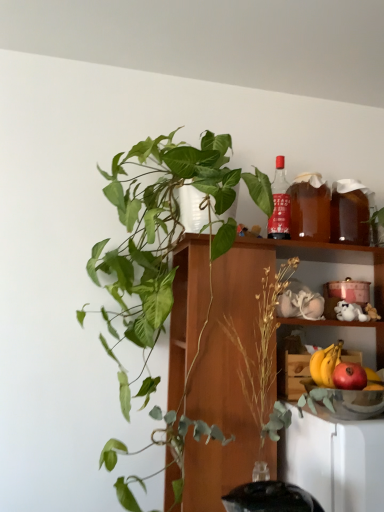
Measure the distance between point [171,250] and camera.

1.64 meters.

You are a GUI agent. You are given a task and a screenshot of the screen. Output one action in this format:
    pyautogui.click(x=<x>, y=<y>)
    Task: Click on the red glass bottle at upper right
    Image resolution: width=384 pixels, height=512 pixels.
    Given the screenshot: What is the action you would take?
    pyautogui.click(x=280, y=204)

How much space does brown translucent beverage at upper right, the 2th beverage positioned from the right, occupy vertically?

brown translucent beverage at upper right, the 2th beverage positioned from the right, is 10.94 inches tall.

Based on the photo, what is the approximate height of wooden shelf at upper center?

wooden shelf at upper center is 29.13 inches tall.

Where is `green matte plant at upper left`? Image resolution: width=384 pixels, height=512 pixels. green matte plant at upper left is located at coordinates (163, 265).

From a real-world perspective, is transparent glass bowl at lower right positioned above or below wooden shelf at upper center?

transparent glass bowl at lower right is situated lower than wooden shelf at upper center in the real world.

Is transparent glass bowl at lower right at the right side of wooden shelf at upper center?

Correct, you'll find transparent glass bowl at lower right to the right of wooden shelf at upper center.

Image resolution: width=384 pixels, height=512 pixels. Find the location of `glass bowl that appears below the wooden shelf at upper center (from a real-world perspective)`. glass bowl that appears below the wooden shelf at upper center (from a real-world perspective) is located at coordinates click(357, 403).

In the scene shown: From a real-world perspective, between transparent glass bowl at lower right and yellow matte banana at lower right, who is vertically lower?

transparent glass bowl at lower right is physically lower.

Is transparent glass bowl at lower right far from yellow matte banana at lower right?

No, transparent glass bowl at lower right is not far away from yellow matte banana at lower right.

Consider the image. Can you confirm if transparent glass bowl at lower right is taller than yellow matte banana at lower right?

No, transparent glass bowl at lower right is not taller than yellow matte banana at lower right.

Is transparent glass bowl at lower right inside the boundaries of yellow matte banana at lower right, or outside?

transparent glass bowl at lower right exists outside the volume of yellow matte banana at lower right.

Is point (281, 238) behind point (316, 356)?

That is True.

Find the location of `bottle above the yellow matte banana at lower right (from a real-world perspective)`. bottle above the yellow matte banana at lower right (from a real-world perspective) is located at coordinates (280, 204).

From the image's perspective, is red glass bottle at upper right over yellow matte banana at lower right?

Yes, from the image's perspective, red glass bottle at upper right is on top of yellow matte banana at lower right.

Based on the photo, from a real-world perspective, is red glass bottle at upper right on yellow matte banana at lower right?

Yes, from a real-world perspective, red glass bottle at upper right is above yellow matte banana at lower right.

In the scene shown: From the image's perspective, between brown translucent beverage at upper right, the 2th beverage positioned from the right, and wooden shelf at upper center, who is located below?

wooden shelf at upper center.

Considering the relative sizes of brown translucent beverage at upper right, the 2th beverage positioned from the right, and wooden shelf at upper center in the image provided, is brown translucent beverage at upper right, the 2th beverage positioned from the right, shorter than wooden shelf at upper center?

Correct, brown translucent beverage at upper right, the 2th beverage positioned from the right, is not as tall as wooden shelf at upper center.

Considering the relative positions of brown translucent beverage at upper right, the 2th beverage positioned from the right, and wooden shelf at upper center in the image provided, is brown translucent beverage at upper right, the 2th beverage positioned from the right, to the right of wooden shelf at upper center from the viewer's perspective?

Indeed, brown translucent beverage at upper right, the 2th beverage positioned from the right, is positioned on the right side of wooden shelf at upper center.

Can you confirm if brown translucent beverage at upper right, the first beverage from the left, is thinner than wooden shelf at upper center?

Correct, the width of brown translucent beverage at upper right, the first beverage from the left, is less than that of wooden shelf at upper center.

Between red matte apple at lower right and yellow matte banana at lower right, which one appears on the right side from the viewer's perspective?

red matte apple at lower right.

Is point (354, 379) closer to viewer compared to point (325, 370)?

Yes, it is in front of point (325, 370).

Considering the relative sizes of red matte apple at lower right and yellow matte banana at lower right in the image provided, is red matte apple at lower right taller than yellow matte banana at lower right?

Incorrect, the height of red matte apple at lower right is not larger of that of yellow matte banana at lower right.

From a real-world perspective, is red matte apple at lower right under yellow matte banana at lower right?

Correct, in the physical world, red matte apple at lower right is lower than yellow matte banana at lower right.

Between yellow matte banana at lower right and red matte apple at lower right, which one has smaller width?

Thinner between the two is yellow matte banana at lower right.

From the image's perspective, is yellow matte banana at lower right above or below red matte apple at lower right?

yellow matte banana at lower right is situated higher than red matte apple at lower right in the image.

Is yellow matte banana at lower right shorter than red matte apple at lower right?

No.

Is red matte apple at lower right at the back of yellow matte banana at lower right?

Yes, red matte apple at lower right is at the back of yellow matte banana at lower right.

Considering the sizes of objects translucent amber liquid at shelf right, arranged as the 1th beverage when viewed from the right, and red matte apple at lower right in the image provided, who is wider, translucent amber liquid at shelf right, arranged as the 1th beverage when viewed from the right, or red matte apple at lower right?

translucent amber liquid at shelf right, arranged as the 1th beverage when viewed from the right.

Does point (333, 234) appear closer or farther from the camera than point (349, 373)?

Point (333, 234).

Which is more to the left, translucent amber liquid at shelf right, arranged as the 1th beverage when viewed from the right, or red matte apple at lower right?

From the viewer's perspective, red matte apple at lower right appears more on the left side.

You are a GUI agent. You are given a task and a screenshot of the screen. Output one action in this format:
    pyautogui.click(x=<x>, y=<y>)
    Task: Click on the apple below the translucent amber liquid at shelf right, arranged as the 2th beverage when viewed from the left (from the image's perspective)
    The width and height of the screenshot is (384, 512).
    Given the screenshot: What is the action you would take?
    pyautogui.click(x=349, y=376)

Find the location of a particular element. The image size is (384, 512). shelf that appears above the transparent glass bowl at lower right (from a real-world perspective) is located at coordinates (241, 361).

Where is `glass bowl that is on the right side of yellow matte banana at lower right`? glass bowl that is on the right side of yellow matte banana at lower right is located at coordinates (357, 403).

Based on their spatial positions, is yellow matte banana at lower right or brown translucent beverage at upper right, the 2th beverage positioned from the right, further from translucent amber liquid at shelf right, arranged as the 1th beverage when viewed from the right?

Based on the image, yellow matte banana at lower right appears to be further to translucent amber liquid at shelf right, arranged as the 1th beverage when viewed from the right.

Estimate the real-world distances between objects in this image. Which object is closer to wooden shelf at upper center, red glass bottle at upper right or red matte apple at lower right?

The object closer to wooden shelf at upper center is red glass bottle at upper right.

Considering their positions, is transparent glass bowl at lower right positioned closer to red matte apple at lower right than red glass bottle at upper right?

The object closer to red matte apple at lower right is transparent glass bowl at lower right.

Looking at this image, when comparing their distances from wooden shelf at upper center, does red glass bottle at upper right or transparent glass bowl at lower right seem further?

The object further to wooden shelf at upper center is red glass bottle at upper right.

From the image, which object appears to be nearer to red matte apple at lower right, transparent glass bowl at lower right or yellow matte banana at lower right?

yellow matte banana at lower right is closer to red matte apple at lower right.

When comparing their distances from yellow matte banana at lower right, does wooden shelf at upper center or red glass bottle at upper right seem further?

Among the two, red glass bottle at upper right is located further to yellow matte banana at lower right.

From the image, which object appears to be nearer to red glass bottle at upper right, red matte apple at lower right or yellow matte banana at lower right?

yellow matte banana at lower right is closer to red glass bottle at upper right.

From the image, which object appears to be nearer to yellow matte banana at lower right, wooden shelf at upper center or brown translucent beverage at upper right, the first beverage from the left?

Among the two, wooden shelf at upper center is located nearer to yellow matte banana at lower right.

This screenshot has height=512, width=384. In order to click on apple between green matte plant at upper left and translucent amber liquid at shelf right, arranged as the 2th beverage when viewed from the left in this screenshot , I will do `click(349, 376)`.

Locate an element on the screen. apple located between wooden shelf at upper center and yellow matte banana at lower right in the depth direction is located at coordinates (349, 376).

You are a GUI agent. You are given a task and a screenshot of the screen. Output one action in this format:
    pyautogui.click(x=<x>, y=<y>)
    Task: Click on the banana between green matte plant at upper left and red matte apple at lower right in the horizontal direction
    
    Given the screenshot: What is the action you would take?
    pyautogui.click(x=325, y=364)

Image resolution: width=384 pixels, height=512 pixels. What are the coordinates of `banana that lies between translucent amber liquid at shelf right, arranged as the 2th beverage when viewed from the left, and red matte apple at lower right from top to bottom` in the screenshot? It's located at (325, 364).